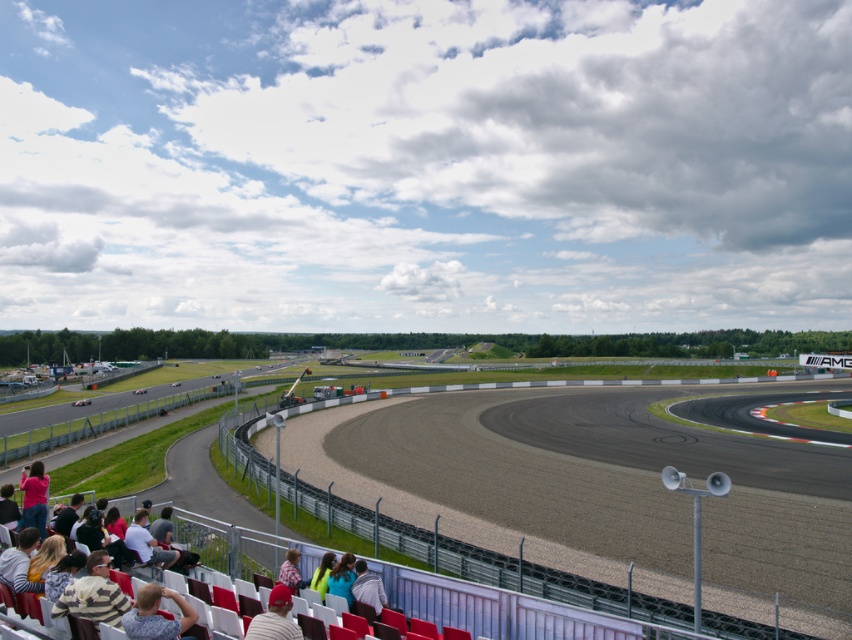
Who is higher up, camouflage fabric shirt at lower left or matte pink shirt at lower left?

A: camouflage fabric shirt at lower left is higher up.

Where is `camouflage fabric shirt at lower left`? Image resolution: width=852 pixels, height=640 pixels. camouflage fabric shirt at lower left is located at coordinates (154, 614).

Locate an element on the screen. The height and width of the screenshot is (640, 852). camouflage fabric shirt at lower left is located at coordinates (154, 614).

Is point (849, 468) positioned behind point (245, 634)?

Yes, it is.

Image resolution: width=852 pixels, height=640 pixels. I want to click on smooth asphalt track at center, so click(603, 490).

I want to click on smooth asphalt track at center, so click(603, 490).

Where is `smooth asphalt track at center`? smooth asphalt track at center is located at coordinates (603, 490).

Is the position of light brown fabric jacket at lower center less distant than that of teal fabric jacket at lower center?

That is True.

What do you see at coordinates (367, 588) in the screenshot?
I see `light brown fabric jacket at lower center` at bounding box center [367, 588].

At what (x,y) coordinates should I click in order to perform the action: click on light brown fabric jacket at lower center. Please return your answer as a coordinate pair (x, y). Looking at the image, I should click on (367, 588).

Where is `light brown fabric jacket at lower center`? The width and height of the screenshot is (852, 640). light brown fabric jacket at lower center is located at coordinates (x=367, y=588).